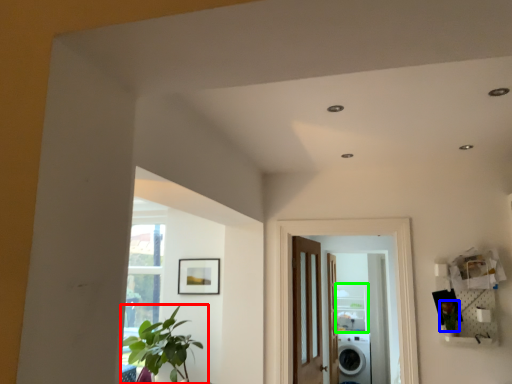
Question: Which is farther away from houseplant (highlighted by a red box)? plant (highlighted by a blue box) or shelf (highlighted by a green box)?

Choices:
 (A) plant
 (B) shelf

Answer: (B)